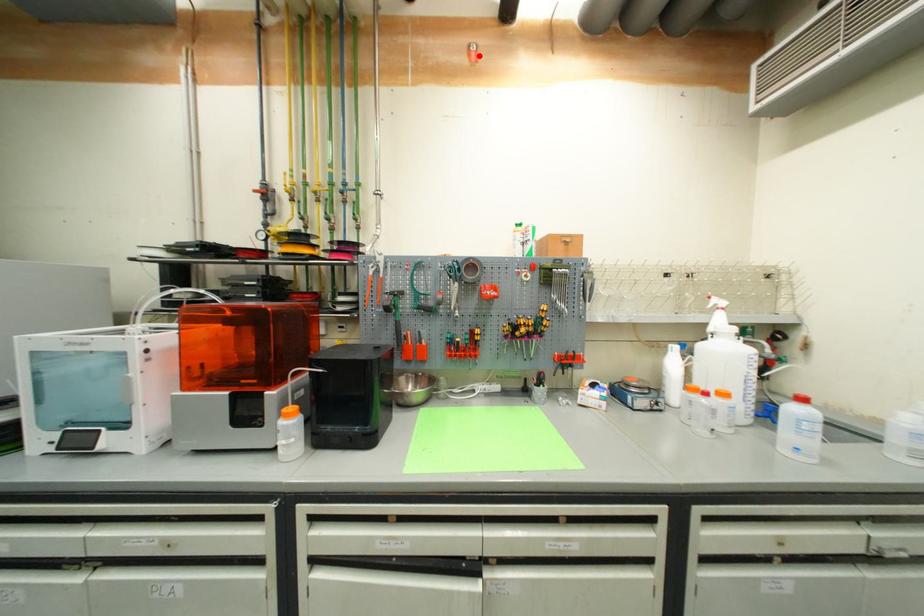
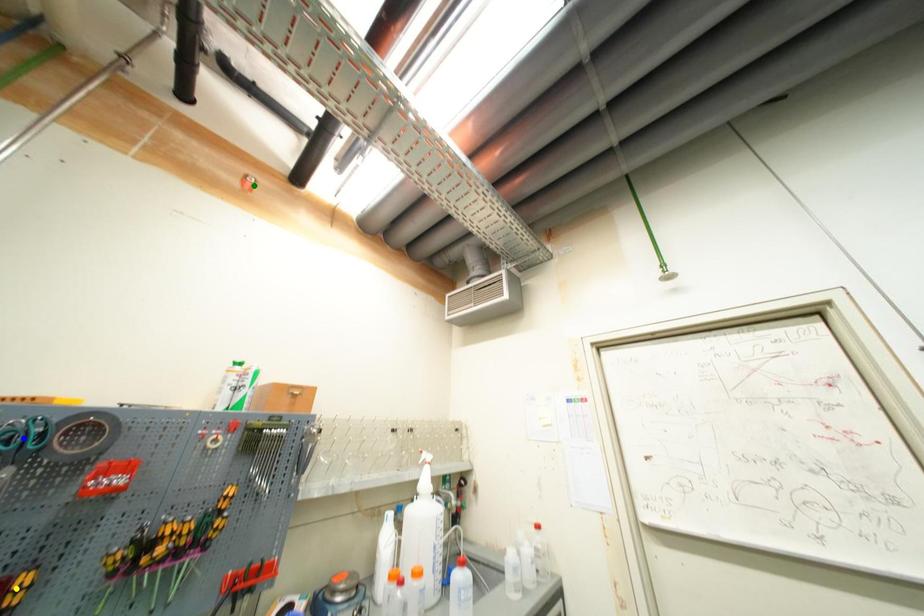
Question: I am providing you with two images of the same scene from different viewpoints. A red point is marked on the first image. You are given multiple points on the second image. Which mark in image 2 goes with the point in image 1?

Choices:
 (A) yellow point
 (B) green point
 (C) blue point

Answer: (B)